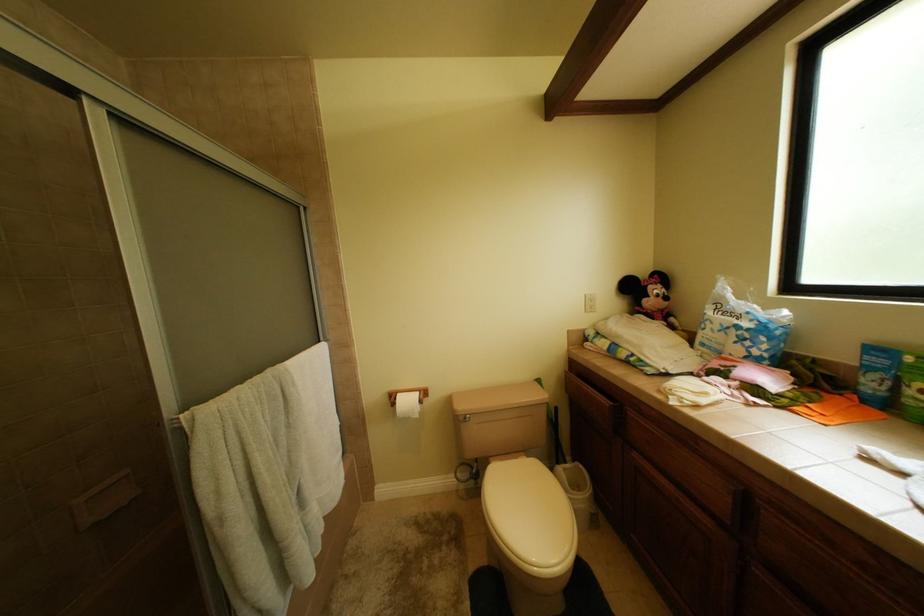
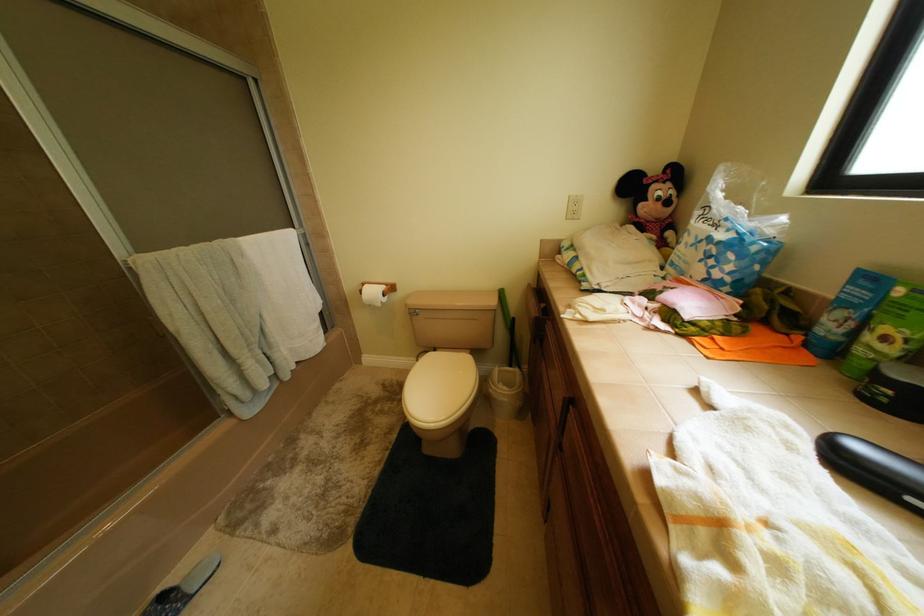
Question: The images are taken continuously from a first-person perspective. In which direction is your viewpoint rotating?

Choices:
 (A) Left
 (B) Right
 (C) Up
 (D) Down

Answer: (D)